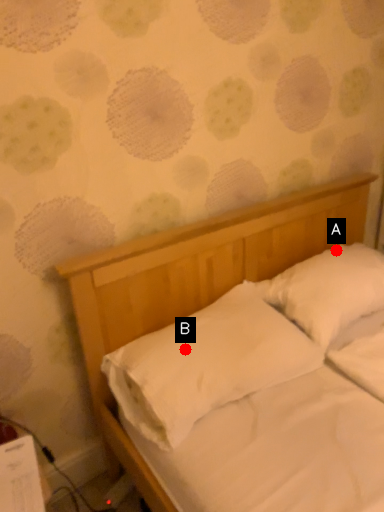
Question: Two points are circled on the image, labeled by A and B beside each circle. Which point is further to the camera?

Choices:
 (A) A is further
 (B) B is further

Answer: (A)